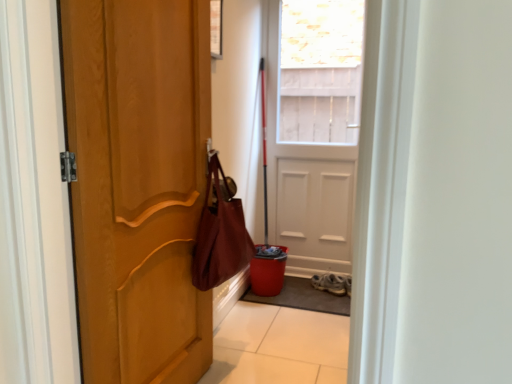
Where is `gray textured mat at lower center`? Image resolution: width=512 pixels, height=384 pixels. gray textured mat at lower center is located at coordinates (303, 297).

Identify the location of matte wood door at left, marked as the 1th door in a front-to-back arrangement. (138, 184).

Between gray textured mat at lower center and white matte door at center, which is counted as the 2th door, starting from the front, which one has larger size?

white matte door at center, which is counted as the 2th door, starting from the front.

Is gray textured mat at lower center oriented away from white matte door at center, acting as the 1th door starting from the right?

No, white matte door at center, acting as the 1th door starting from the right, is not at the back of gray textured mat at lower center.

Between gray textured mat at lower center and white matte door at center, acting as the 1th door starting from the right, which one is positioned behind?

white matte door at center, acting as the 1th door starting from the right, is further from the camera.

Is gray textured mat at lower center not close to white matte door at center, which is counted as the 2th door, starting from the front?

No, gray textured mat at lower center is in close proximity to white matte door at center, which is counted as the 2th door, starting from the front.

Considering the sizes of objects leather-like maroon shoulder bag at center-left and white matte door at center, acting as the 1th door starting from the right, in the image provided, who is smaller, leather-like maroon shoulder bag at center-left or white matte door at center, acting as the 1th door starting from the right,?

leather-like maroon shoulder bag at center-left is smaller.

I want to click on shoulder bag located in front of the white matte door at center, acting as the 1th door starting from the right, so click(x=220, y=232).

Is leather-like maroon shoulder bag at center-left to the left of white matte door at center, acting as the 1th door starting from the right, from the viewer's perspective?

Yes, leather-like maroon shoulder bag at center-left is to the left of white matte door at center, acting as the 1th door starting from the right.

Does gray textured mat at lower center appear on the right side of white leather sneakers at lower center?

Incorrect, gray textured mat at lower center is not on the right side of white leather sneakers at lower center.

Considering the positions of objects gray textured mat at lower center and white leather sneakers at lower center in the image provided, who is in front, gray textured mat at lower center or white leather sneakers at lower center?

Positioned in front is gray textured mat at lower center.

From a real-world perspective, is gray textured mat at lower center positioned above or below white leather sneakers at lower center?

Clearly, from a real-world perspective, gray textured mat at lower center is below white leather sneakers at lower center.

Is there a large distance between gray textured mat at lower center and white leather sneakers at lower center?

gray textured mat at lower center is actually quite close to white leather sneakers at lower center.

Which object is more forward, matte wood door at left, marked as the 1th door in a front-to-back arrangement, or leather-like maroon shoulder bag at center-left?

matte wood door at left, marked as the 1th door in a front-to-back arrangement, is closer to the camera.

Is matte wood door at left, which appears as the second door when viewed from the right, bigger than leather-like maroon shoulder bag at center-left?

Indeed, matte wood door at left, which appears as the second door when viewed from the right, has a larger size compared to leather-like maroon shoulder bag at center-left.

Considering the relative sizes of matte wood door at left, which appears as the second door when viewed from the right, and leather-like maroon shoulder bag at center-left in the image provided, is matte wood door at left, which appears as the second door when viewed from the right, thinner than leather-like maroon shoulder bag at center-left?

Indeed, matte wood door at left, which appears as the second door when viewed from the right, has a lesser width compared to leather-like maroon shoulder bag at center-left.

From the picture: Do you think matte wood door at left, which ranks as the 2th door in back-to-front order, is within leather-like maroon shoulder bag at center-left, or outside of it?

matte wood door at left, which ranks as the 2th door in back-to-front order, lies outside leather-like maroon shoulder bag at center-left.

From the image's perspective, who appears lower, leather-like maroon shoulder bag at center-left or white leather sneakers at lower center?

white leather sneakers at lower center, from the image's perspective.

Is leather-like maroon shoulder bag at center-left oriented away from white leather sneakers at lower center?

No, leather-like maroon shoulder bag at center-left is not facing away from white leather sneakers at lower center.

Consider the image. From a real-world perspective, between leather-like maroon shoulder bag at center-left and white leather sneakers at lower center, who is vertically lower?

white leather sneakers at lower center.

Can you see leather-like maroon shoulder bag at center-left touching white leather sneakers at lower center?

No.

Does matte wood door at left, marked as the 1th door in a front-to-back arrangement, contain gray textured mat at lower center?

No.

From a real-world perspective, is matte wood door at left, which appears as the second door when viewed from the right, beneath gray textured mat at lower center?

Actually, matte wood door at left, which appears as the second door when viewed from the right, is physically above gray textured mat at lower center in the real world.

Is point (77, 207) farther from viewer compared to point (334, 305)?

No, it is in front of (334, 305).

Can you confirm if matte wood door at left, which ranks as the 2th door in back-to-front order, is wider than gray textured mat at lower center?

No, matte wood door at left, which ranks as the 2th door in back-to-front order, is not wider than gray textured mat at lower center.

Which is correct: white leather sneakers at lower center is inside gray textured mat at lower center, or outside of it?

white leather sneakers at lower center lies outside gray textured mat at lower center.

Considering the points (328, 275) and (341, 295), which point is behind, point (328, 275) or point (341, 295)?

The point (328, 275) is farther from the camera.

Which object is further away from the camera, white leather sneakers at lower center or gray textured mat at lower center?

white leather sneakers at lower center is further away from the camera.

Looking at the image, does white leather sneakers at lower center seem bigger or smaller compared to gray textured mat at lower center?

Clearly, white leather sneakers at lower center is smaller in size than gray textured mat at lower center.

Where is `doormat that appears below the white matte door at center, which is the first door from back to front (from a real-world perspective)`? The image size is (512, 384). doormat that appears below the white matte door at center, which is the first door from back to front (from a real-world perspective) is located at coordinates 303,297.

I want to click on door lying behind the leather-like maroon shoulder bag at center-left, so click(313, 129).

Estimate the real-world distances between objects in this image. Which object is further from white matte door at center, which is counted as the second door, starting from the left, leather-like maroon shoulder bag at center-left or matte wood door at left, marked as the 1th door in a front-to-back arrangement?

The object further to white matte door at center, which is counted as the second door, starting from the left, is matte wood door at left, marked as the 1th door in a front-to-back arrangement.

When comparing their distances from leather-like maroon shoulder bag at center-left, does white matte door at center, which is counted as the second door, starting from the left, or gray textured mat at lower center seem closer?

The object closer to leather-like maroon shoulder bag at center-left is gray textured mat at lower center.

When comparing their distances from matte wood door at left, which ranks as the 2th door in back-to-front order, does white leather sneakers at lower center or leather-like maroon shoulder bag at center-left seem further?

Among the two, white leather sneakers at lower center is located further to matte wood door at left, which ranks as the 2th door in back-to-front order.

From the image, which object appears to be farther from matte wood door at left, marked as the 1th door in a front-to-back arrangement, white matte door at center, which is the first door from back to front, or gray textured mat at lower center?

Based on the image, white matte door at center, which is the first door from back to front, appears to be further to matte wood door at left, marked as the 1th door in a front-to-back arrangement.

From the image, which object appears to be nearer to leather-like maroon shoulder bag at center-left, white leather sneakers at lower center or gray textured mat at lower center?

gray textured mat at lower center.

Considering their positions, is matte wood door at left, which ranks as the 2th door in back-to-front order, positioned closer to leather-like maroon shoulder bag at center-left than white matte door at center, which is the first door from back to front?

The object closer to leather-like maroon shoulder bag at center-left is matte wood door at left, which ranks as the 2th door in back-to-front order.

Based on their spatial positions, is gray textured mat at lower center or white matte door at center, acting as the 1th door starting from the right, further from white leather sneakers at lower center?

The object further to white leather sneakers at lower center is white matte door at center, acting as the 1th door starting from the right.

Considering their positions, is white leather sneakers at lower center positioned further to matte wood door at left, the 1th door in the left-to-right sequence, than gray textured mat at lower center?

white leather sneakers at lower center is positioned further to the anchor matte wood door at left, the 1th door in the left-to-right sequence.

This screenshot has width=512, height=384. I want to click on doormat positioned between leather-like maroon shoulder bag at center-left and white matte door at center, which is counted as the second door, starting from the left, from near to far, so click(303, 297).

Locate an element on the screen. shoulder bag between matte wood door at left, which appears as the second door when viewed from the right, and gray textured mat at lower center in the front-back direction is located at coordinates (220, 232).

The image size is (512, 384). Identify the location of doormat positioned between matte wood door at left, marked as the 1th door in a front-to-back arrangement, and white leather sneakers at lower center from near to far. (303, 297).

Locate an element on the screen. door positioned between matte wood door at left, marked as the 1th door in a front-to-back arrangement, and white leather sneakers at lower center from near to far is located at coordinates (313, 129).